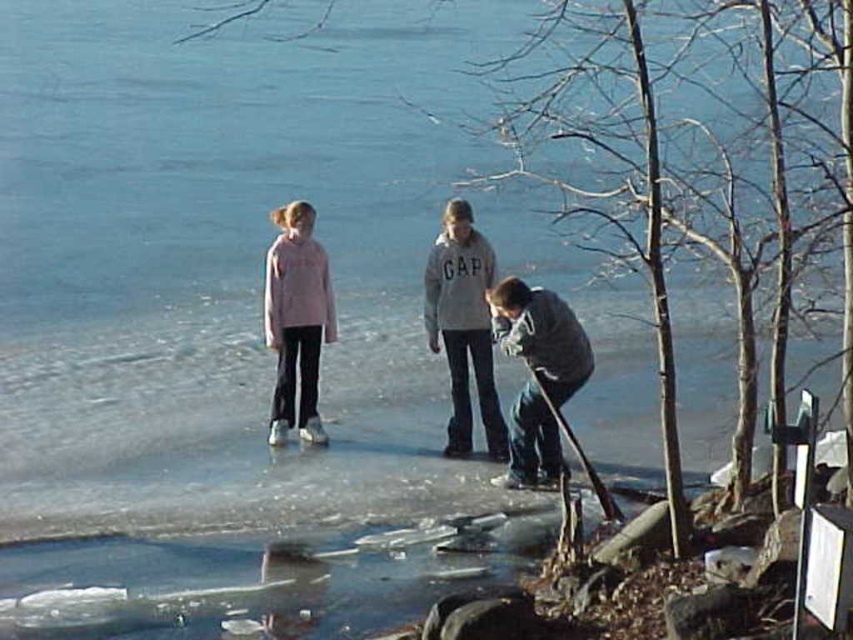
You are a parent supervising two children playing on the ice. You notice the gray cotton hoodie at center and pink fleece jacket at center. Which child is wearing a larger sized clothing?

The gray cotton hoodie at center has a larger size compared to the pink fleece jacket at center, so the child wearing the gray cotton hoodie at center has a larger sized clothing.

You are a safety inspector assessing the scene. The gray wool sweater at lower center is part of a group on thin ice. Given the ice is unsafe beyond 12 meters from shore, can the group safely move towards the shore?

The gray wool sweater at lower center is 12.16 meters away from the camera, which likely represents the shore. Since the safe distance is under 12 meters, they are slightly beyond the safe zone and should move cautiously.

You are a safety officer inspecting the ice conditions. You see the gray cotton hoodie at center and the pink fleece jacket at center. Which individual is closer to you, and why might this be concerning?

The gray cotton hoodie at center is closer to the viewer than the pink fleece jacket at center. This is concerning because being closer to the thin and cracked ice puts them at higher risk of falling through.